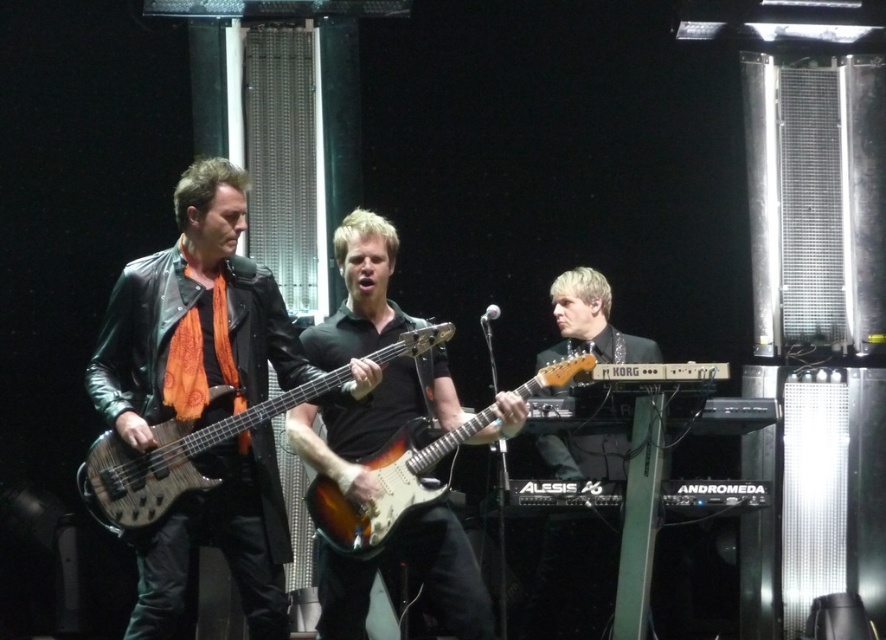
Between point (339, 417) and point (657, 358), which one is positioned behind?

Point (657, 358)

This screenshot has width=886, height=640. What are the coordinates of `black matte guitar at center` in the screenshot? It's located at (374, 420).

Between point (313, 353) and point (588, 579), which one is positioned in front?

Point (313, 353) is in front.

I want to click on black matte guitar at center, so click(x=374, y=420).

Is black matte guitar at center positioned before sunburst wood electric guitar at center?

No, it is behind sunburst wood electric guitar at center.

Measure the distance from black matte guitar at center to sunburst wood electric guitar at center.

black matte guitar at center and sunburst wood electric guitar at center are 25.18 centimeters apart from each other.

Is point (392, 326) closer to camera compared to point (543, 368)?

Yes, point (392, 326) is in front of point (543, 368).

Find the location of `black matte guitar at center`. black matte guitar at center is located at coordinates (374, 420).

Who is positioned more to the right, shiny black guitar at right or sunburst wood electric guitar at center?

shiny black guitar at right is more to the right.

Who is higher up, shiny black guitar at right or sunburst wood electric guitar at center?

sunburst wood electric guitar at center is above.

Is point (602, 611) behind point (351, 548)?

Yes, point (602, 611) is farther from viewer.

Image resolution: width=886 pixels, height=640 pixels. I want to click on shiny black guitar at right, so click(x=573, y=580).